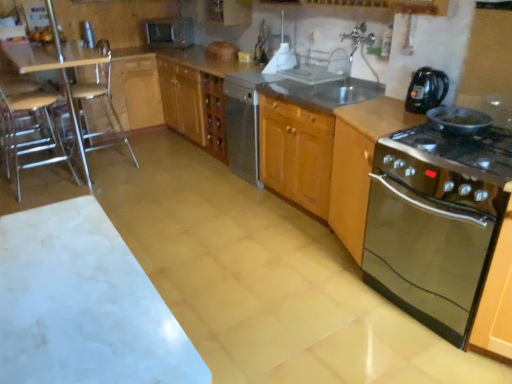
This screenshot has width=512, height=384. Find the location of `vacant area that lies between clear plastic bar stool at left, the first bar stool viewed from the right, and wooden seat at left, arranged as the second bar stool when viewed from the right`. vacant area that lies between clear plastic bar stool at left, the first bar stool viewed from the right, and wooden seat at left, arranged as the second bar stool when viewed from the right is located at coordinates (93, 180).